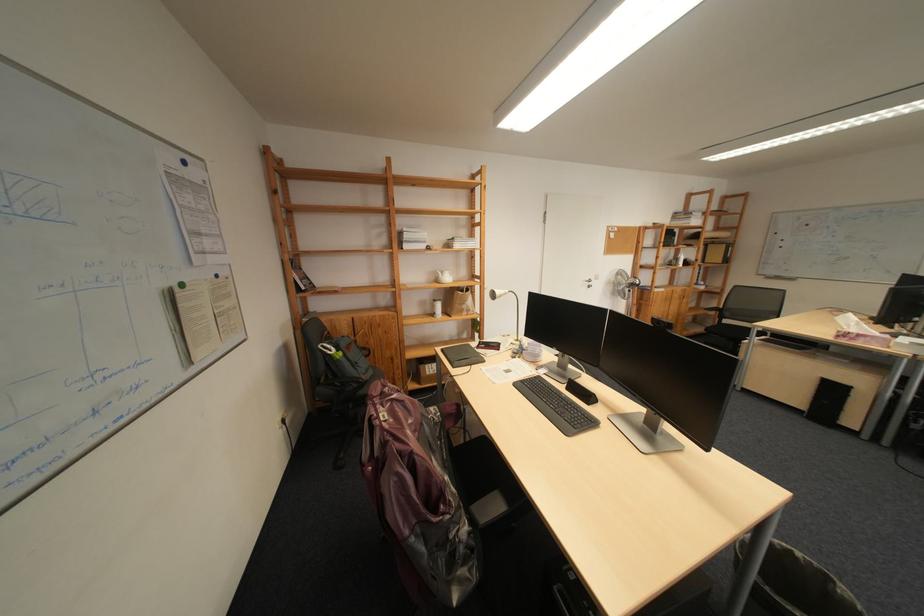
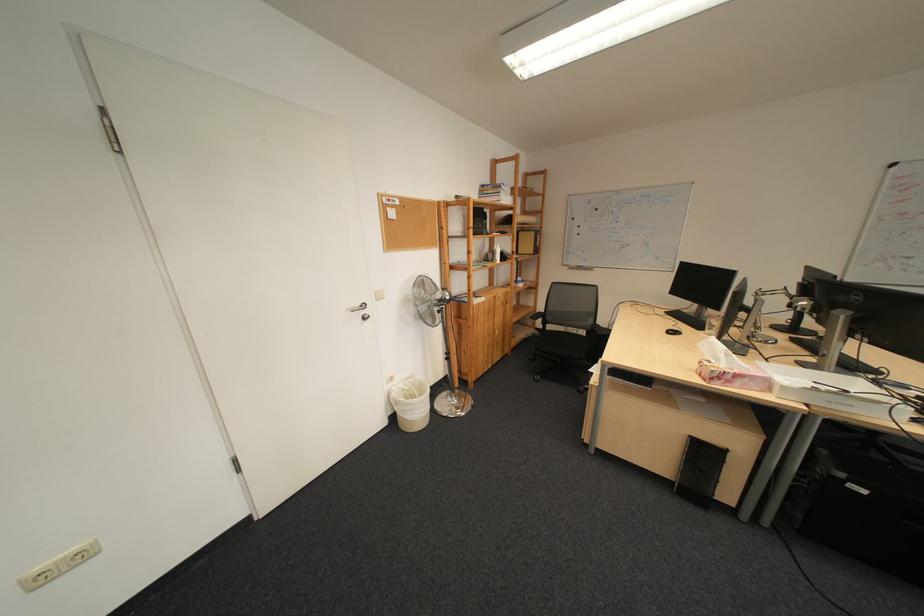
The point at (623, 284) is marked in the first image. Where is the corresponding point in the second image?

(419, 302)